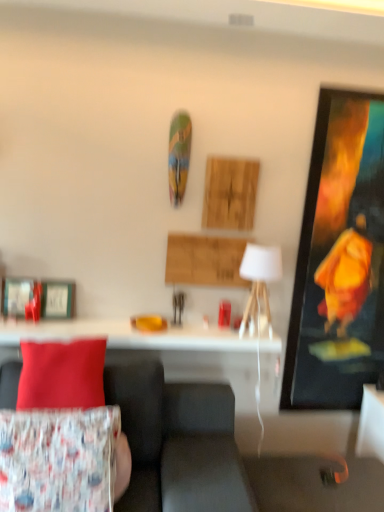
Question: From a real-world perspective, does velvet fabric couch at lower left sit lower than printed fabric cushion at lower left?

Choices:
 (A) yes
 (B) no

Answer: (A)

Question: From the image's perspective, is velvet fabric couch at lower left over printed fabric cushion at lower left?

Choices:
 (A) yes
 (B) no

Answer: (B)

Question: Can you confirm if velvet fabric couch at lower left is positioned to the left of printed fabric cushion at lower left?

Choices:
 (A) yes
 (B) no

Answer: (B)

Question: From a real-world perspective, is velvet fabric couch at lower left positioned over printed fabric cushion at lower left based on gravity?

Choices:
 (A) yes
 (B) no

Answer: (B)

Question: Is velvet fabric couch at lower left closer to the viewer compared to printed fabric cushion at lower left?

Choices:
 (A) yes
 (B) no

Answer: (A)

Question: Can you confirm if velvet fabric couch at lower left is smaller than printed fabric cushion at lower left?

Choices:
 (A) yes
 (B) no

Answer: (B)

Question: Does floral fabric cushion at lower left, the 2th pillow positioned from the top, have a lesser width compared to white glossy table at center?

Choices:
 (A) no
 (B) yes

Answer: (A)

Question: From the image's perspective, is floral fabric cushion at lower left, the 2th pillow positioned from the top, on top of white glossy table at center?

Choices:
 (A) yes
 (B) no

Answer: (B)

Question: From a real-world perspective, is floral fabric cushion at lower left, the first pillow when ordered from bottom to top, physically above white glossy table at center?

Choices:
 (A) yes
 (B) no

Answer: (B)

Question: Is floral fabric cushion at lower left, the first pillow when ordered from bottom to top, positioned beyond the bounds of white glossy table at center?

Choices:
 (A) no
 (B) yes

Answer: (B)

Question: Is floral fabric cushion at lower left, the 2th pillow positioned from the top, next to white glossy table at center?

Choices:
 (A) no
 (B) yes

Answer: (A)

Question: From a real-world perspective, is floral fabric cushion at lower left, the first pillow when ordered from bottom to top, located beneath white glossy table at center?

Choices:
 (A) no
 (B) yes

Answer: (B)

Question: Considering the relative sizes of velvet fabric couch at lower left and metallic silver picture frame at left in the image provided, is velvet fabric couch at lower left bigger than metallic silver picture frame at left?

Choices:
 (A) no
 (B) yes

Answer: (B)